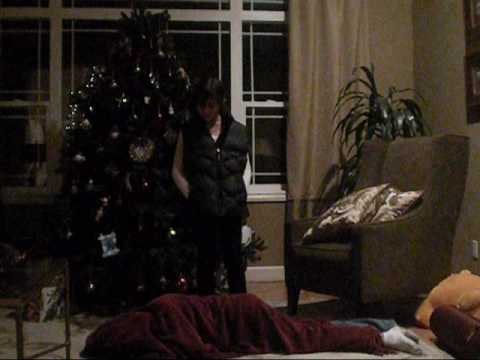
Find the location of `pillow with swirl pattern`. pillow with swirl pattern is located at coordinates (356, 204), (385, 210).